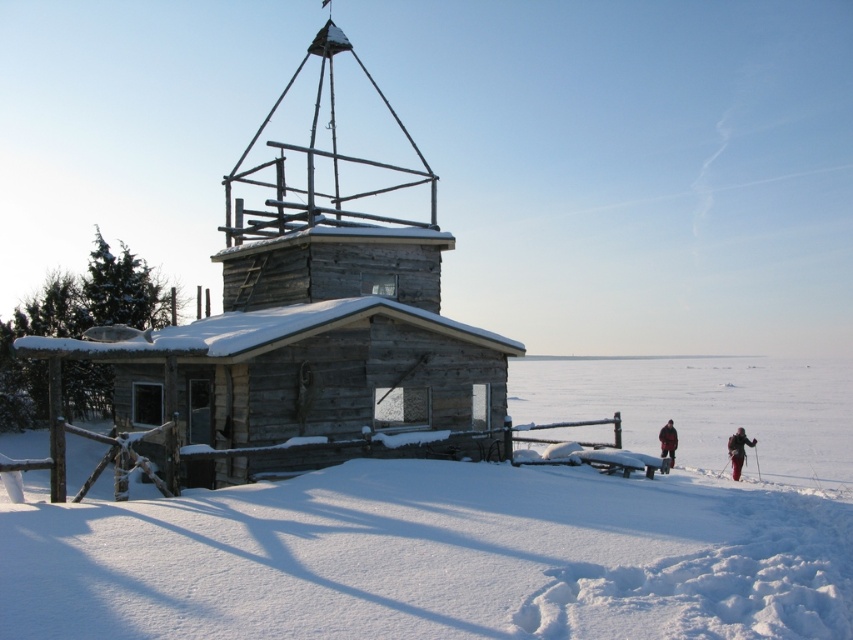
Question: Does white snow at lower left have a smaller size compared to dark red fabric jacket at lower right?

Choices:
 (A) no
 (B) yes

Answer: (A)

Question: Is dark red ski suit at lower right positioned at the back of dark red fabric jacket at lower right?

Choices:
 (A) yes
 (B) no

Answer: (B)

Question: Which object is closer to the camera taking this photo?

Choices:
 (A) white snow at lower left
 (B) dark red ski suit at lower right

Answer: (A)

Question: Which object is the farthest from the dark red ski suit at lower right?

Choices:
 (A) white snow at lower left
 (B) dark red fabric jacket at lower right

Answer: (A)

Question: Does dark red ski suit at lower right come behind dark red fabric jacket at lower right?

Choices:
 (A) yes
 (B) no

Answer: (B)

Question: Which point appears closest to the camera in this image?

Choices:
 (A) (759, 385)
 (B) (671, 428)

Answer: (B)